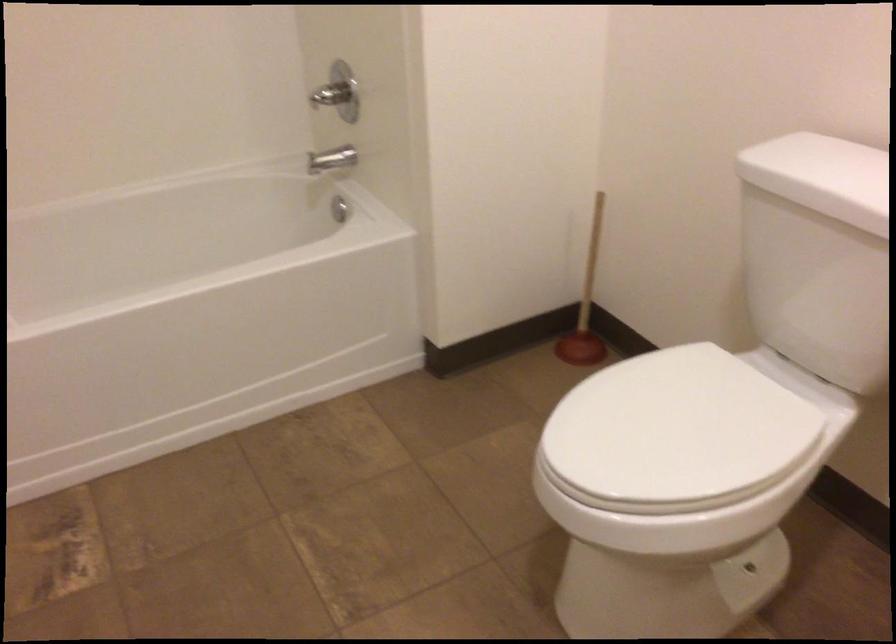
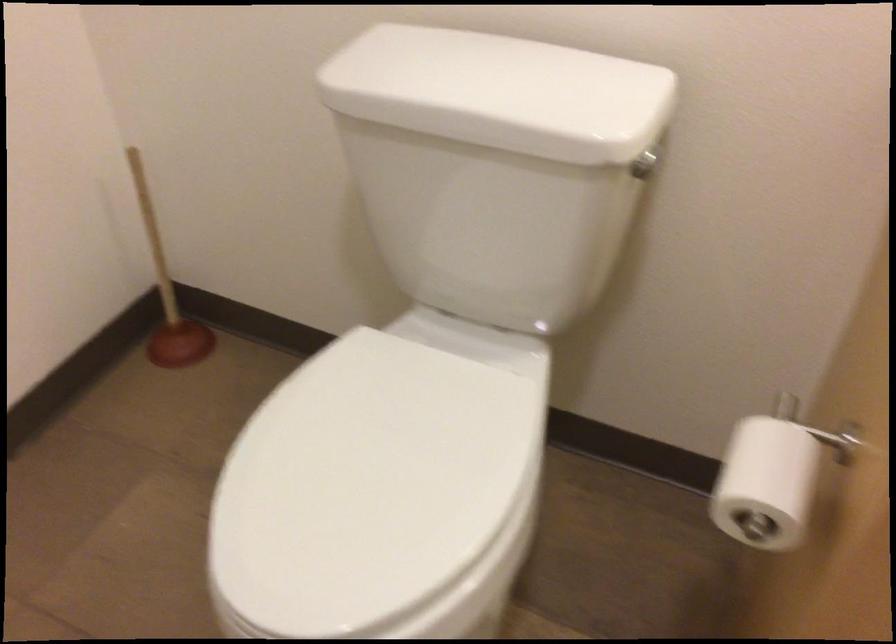
In the second image, find the point that corresponds to point (581, 298) in the first image.

(167, 292)